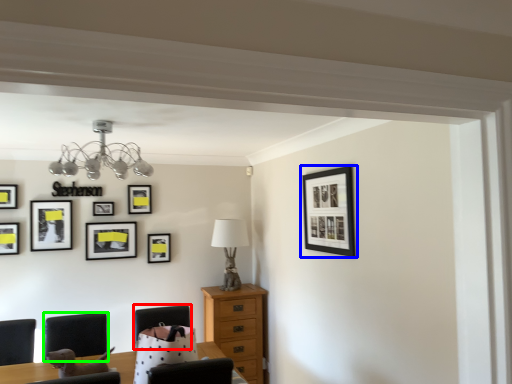
Question: Which object is positioned closest to armchair (highlighted by a red box)? Select from picture frame (highlighted by a blue box) and armchair (highlighted by a green box).

Choices:
 (A) picture frame
 (B) armchair

Answer: (B)